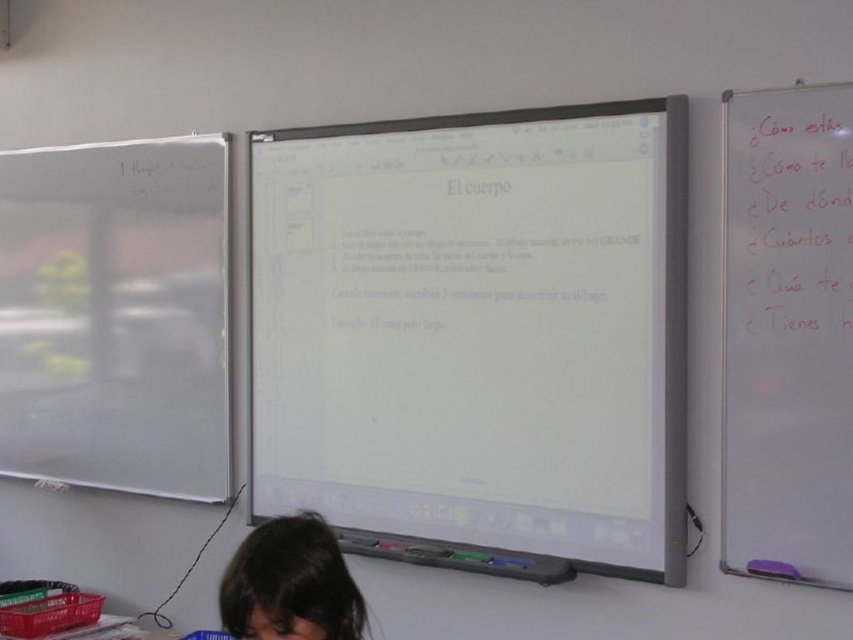
Question: Among these points, which one is farthest from the camera?

Choices:
 (A) (598, 202)
 (B) (831, 164)
 (C) (813, 353)

Answer: (A)

Question: Is whiteboard at right smaller than dark brown hair at lower center?

Choices:
 (A) yes
 (B) no

Answer: (B)

Question: Does white glossy projector screen at center appear on the left side of whiteboard at right?

Choices:
 (A) yes
 (B) no

Answer: (A)

Question: Is white glossy projector screen at center below plastic crate at lower left?

Choices:
 (A) yes
 (B) no

Answer: (B)

Question: Based on their relative distances, which object is nearer to the dark brown hair at lower center?

Choices:
 (A) white glossy projector screen at center
 (B) whiteboard at right
 (C) plastic crate at lower left

Answer: (A)

Question: Which object appears farthest from the camera in this image?

Choices:
 (A) red marker writing at upper right
 (B) dark brown hair at lower center
 (C) whiteboard at right

Answer: (A)